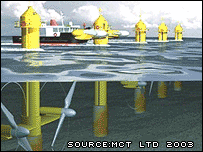
Where is `window`? This screenshot has height=152, width=203. window is located at coordinates (55, 29).